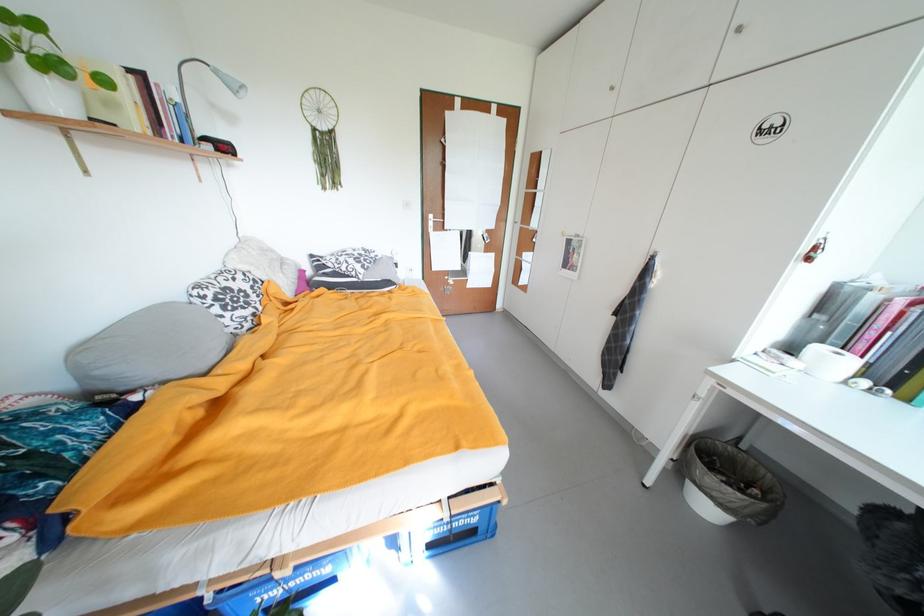
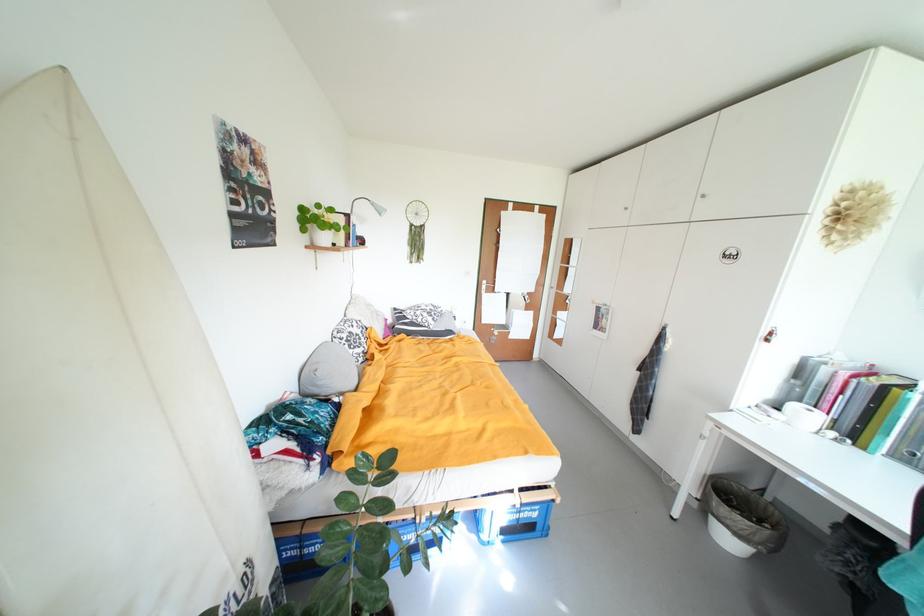
In the second image, find the point that corresponds to point 444,232 in the first image.

(494, 294)